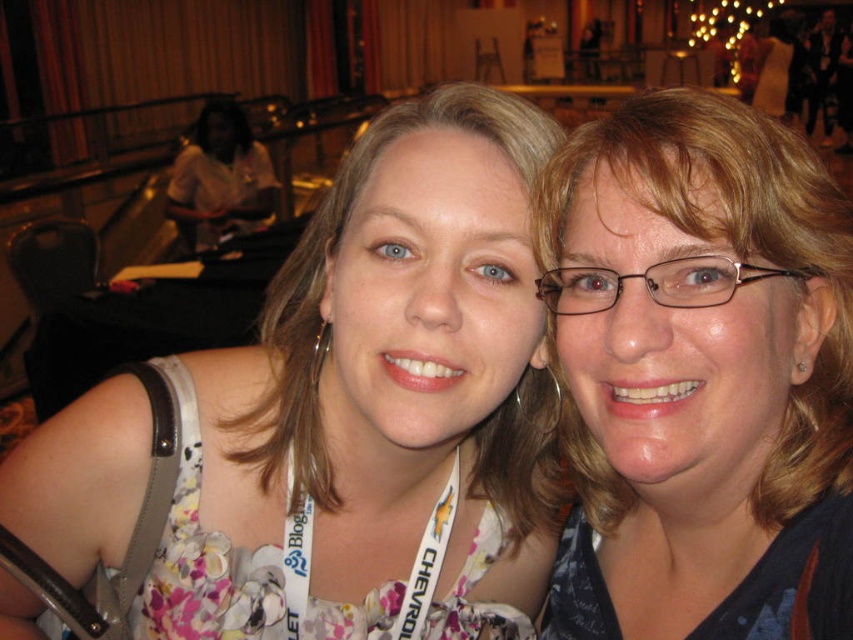
Question: Which object is farther from the camera taking this photo?

Choices:
 (A) white fabric lanyard at center
 (B) floral fabric dress at center

Answer: (A)

Question: Can you confirm if floral fabric dress at center is thinner than matte black glasses at center?

Choices:
 (A) yes
 (B) no

Answer: (B)

Question: Estimate the real-world distances between objects in this image. Which object is closer to the white fabric lanyard at center?

Choices:
 (A) matte black glasses at center
 (B) floral fabric dress at center

Answer: (B)

Question: Is floral fabric dress at center in front of white fabric lanyard at center?

Choices:
 (A) no
 (B) yes

Answer: (B)

Question: Which object appears closest to the camera in this image?

Choices:
 (A) matte black glasses at center
 (B) white fabric lanyard at center
 (C) floral fabric dress at center

Answer: (A)

Question: Where is matte black glasses at center located in relation to white fabric lanyard at center in the image?

Choices:
 (A) left
 (B) right

Answer: (B)